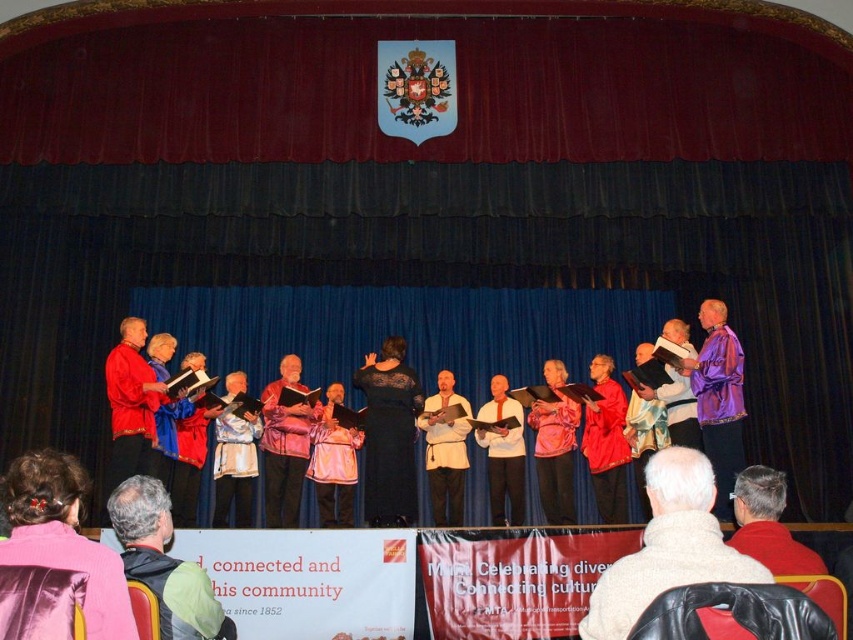
Question: Does satin pink jacket at lower left have a greater width compared to black lace dress at center?

Choices:
 (A) no
 (B) yes

Answer: (B)

Question: Is light brown leather jacket at lower left positioned before leather jacket at lower right?

Choices:
 (A) yes
 (B) no

Answer: (B)

Question: Which object appears farthest from the camera in this image?

Choices:
 (A) satin pink jacket at lower left
 (B) black lace dress at center

Answer: (B)

Question: Which point is closer to the camera?

Choices:
 (A) leather jacket at lower right
 (B) black lace dress at center
 (C) light brown leather jacket at lower left
 (D) satin pink jacket at lower left

Answer: (D)

Question: Which of the following is the closest to the observer?

Choices:
 (A) (740, 472)
 (B) (373, 456)
 (C) (10, 561)
 (D) (165, 579)

Answer: (C)

Question: Is light brown leather jacket at lower left below black lace dress at center?

Choices:
 (A) yes
 (B) no

Answer: (A)